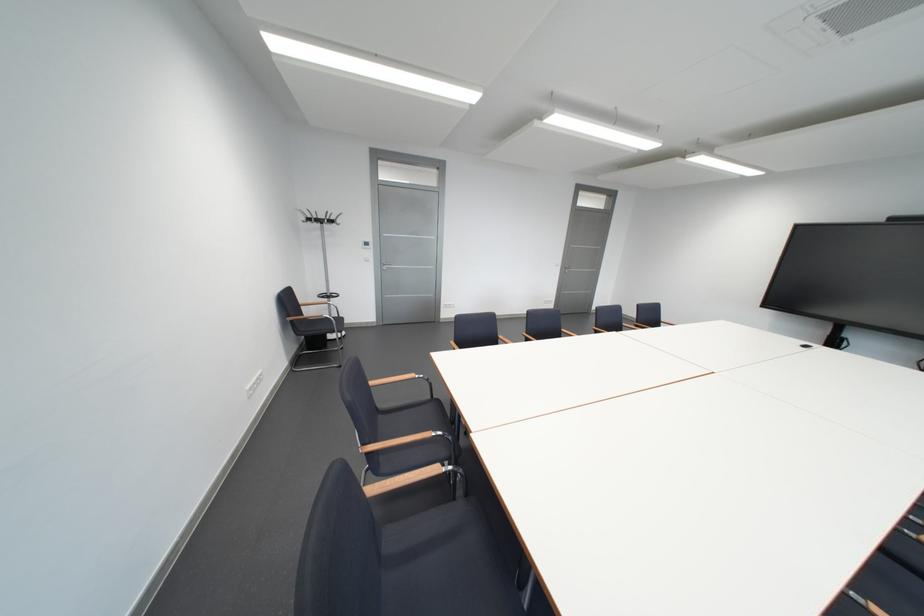
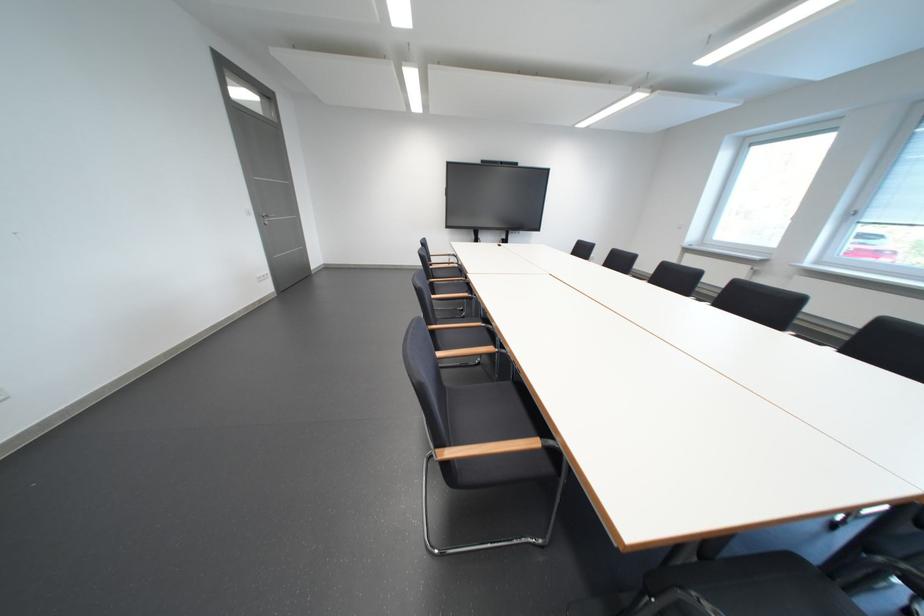
The point at (578, 270) is marked in the first image. Where is the corresponding point in the second image?

(274, 217)